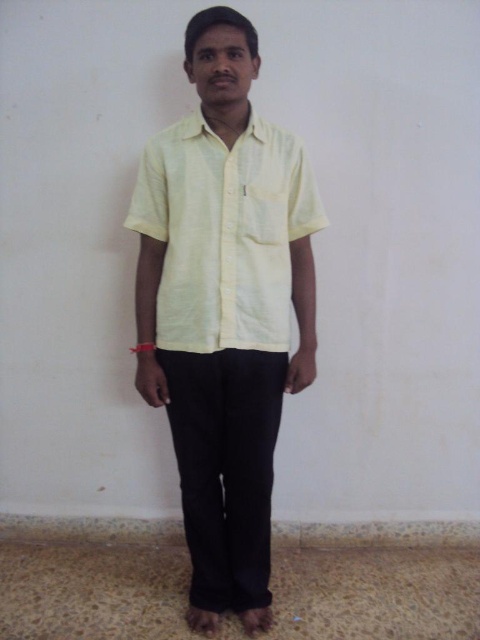
From the picture: Is light yellow fabric shirt at center closer to camera compared to light yellow linen shirt at center?

Yes.

This screenshot has width=480, height=640. What do you see at coordinates (224, 310) in the screenshot?
I see `light yellow fabric shirt at center` at bounding box center [224, 310].

What are the coordinates of `light yellow fabric shirt at center` in the screenshot? It's located at (224, 310).

Can you confirm if light yellow linen shirt at center is bigger than black cotton pants at center?

Incorrect, light yellow linen shirt at center is not larger than black cotton pants at center.

Who is positioned more to the right, light yellow linen shirt at center or black cotton pants at center?

light yellow linen shirt at center is more to the right.

Locate an element on the screen. light yellow linen shirt at center is located at coordinates (224, 232).

Does light yellow fabric shirt at center have a lesser width compared to black cotton pants at center?

In fact, light yellow fabric shirt at center might be wider than black cotton pants at center.

Who is higher up, light yellow fabric shirt at center or black cotton pants at center?

Positioned higher is light yellow fabric shirt at center.

Is point (171, 326) less distant than point (200, 378)?

No, it is behind (200, 378).

Where is `light yellow fabric shirt at center`? This screenshot has height=640, width=480. light yellow fabric shirt at center is located at coordinates (224, 310).